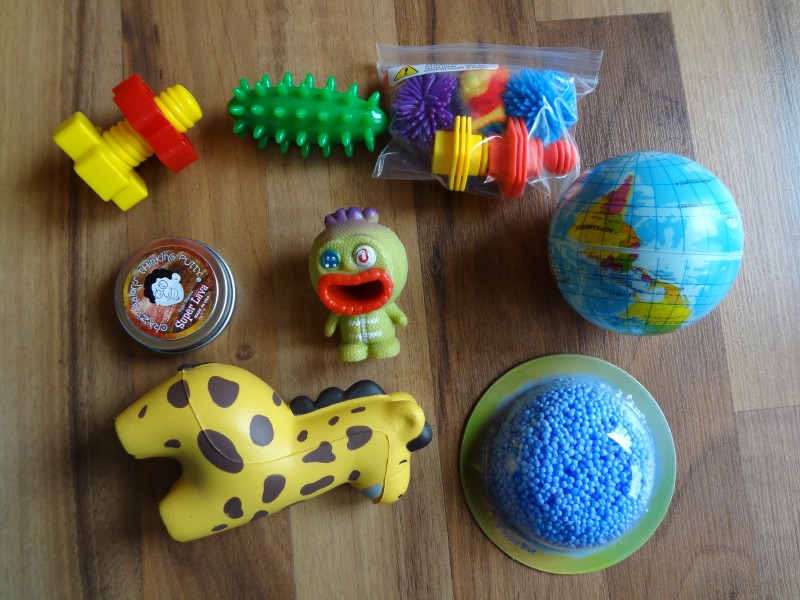
The image size is (800, 600). Find the location of `blue toys`. blue toys is located at coordinates (585, 463), (654, 266), (546, 103).